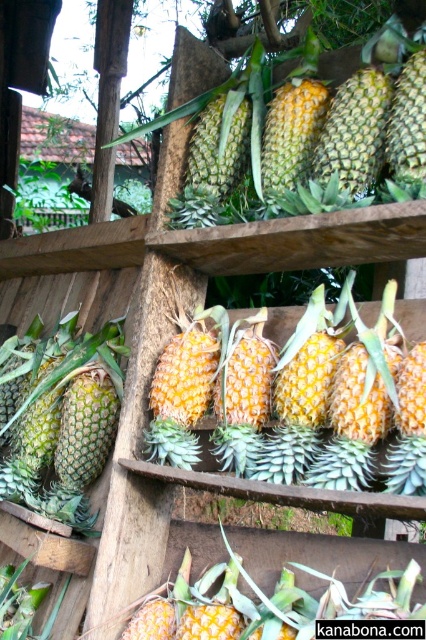
Is point (345, 376) positioned after point (402, 120)?

No, (345, 376) is closer to viewer.

Does yellow matte pineapple at center appear over green spiky pineapple at center?

Incorrect, yellow matte pineapple at center is not positioned above green spiky pineapple at center.

Find the location of `yellow matte pineapple at center`. yellow matte pineapple at center is located at coordinates (351, 404).

I want to click on yellow-green spiky pineapple at center-left, so click(x=69, y=429).

Can you confirm if yellow-green spiky pineapple at center-left is positioned to the left of green spiky pineapple at center?

Correct, you'll find yellow-green spiky pineapple at center-left to the left of green spiky pineapple at center.

The width and height of the screenshot is (426, 640). I want to click on yellow-green spiky pineapple at center-left, so click(69, 429).

Locate an element on the screen. The width and height of the screenshot is (426, 640). yellow matte pineapple at center is located at coordinates (351, 404).

Does yellow matte pineapple at center appear on the left side of yellow-green spiky pineapple at center-left?

Incorrect, yellow matte pineapple at center is not on the left side of yellow-green spiky pineapple at center-left.

What do you see at coordinates (351, 404) in the screenshot? Image resolution: width=426 pixels, height=640 pixels. I see `yellow matte pineapple at center` at bounding box center [351, 404].

At what (x,y) coordinates should I click in order to perform the action: click on yellow matte pineapple at center. Please return your answer as a coordinate pair (x, y). Looking at the image, I should click on (351, 404).